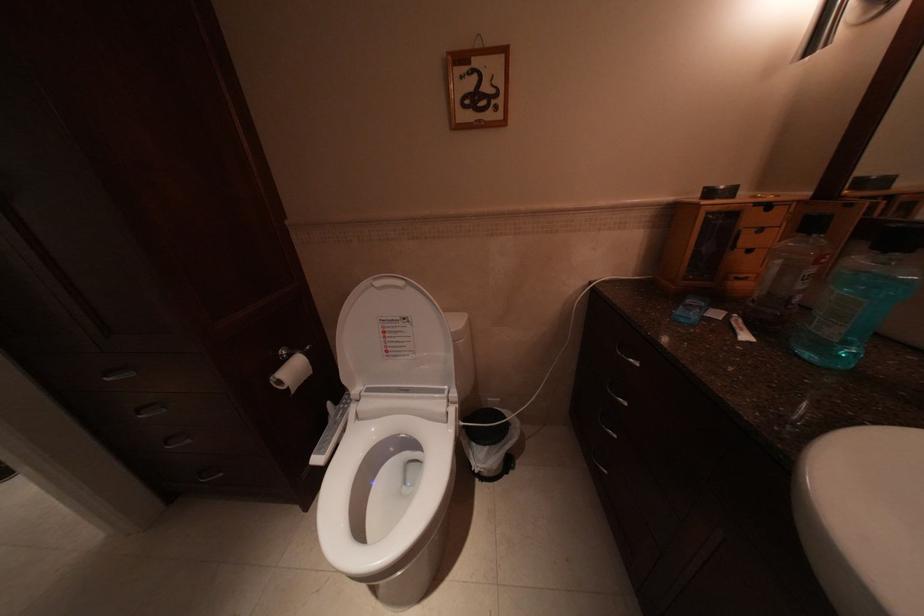
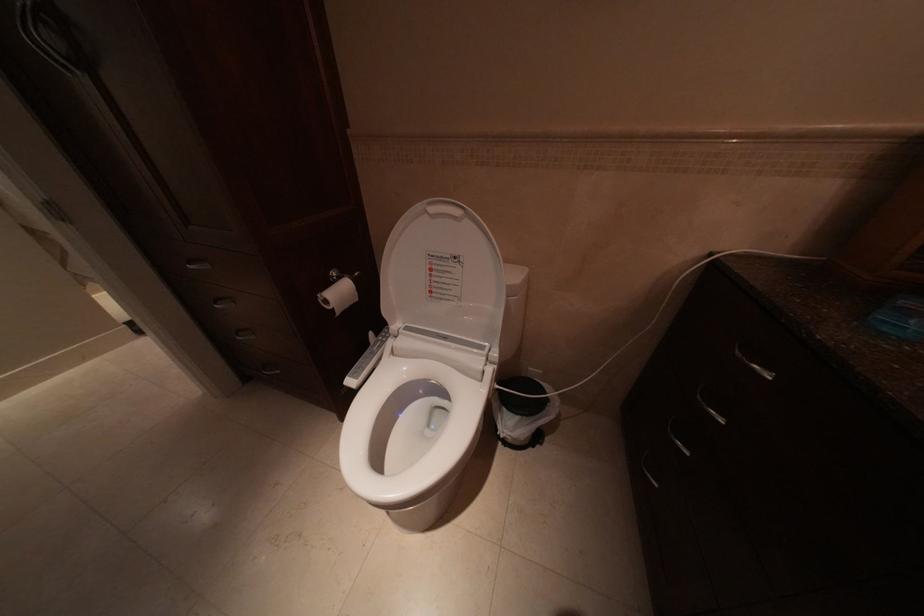
Question: Based on the continuous images, in which direction is the camera rotating? Reply with the corresponding letter.

Choices:
 (A) Left
 (B) Right
 (C) Up
 (D) Down

Answer: (A)